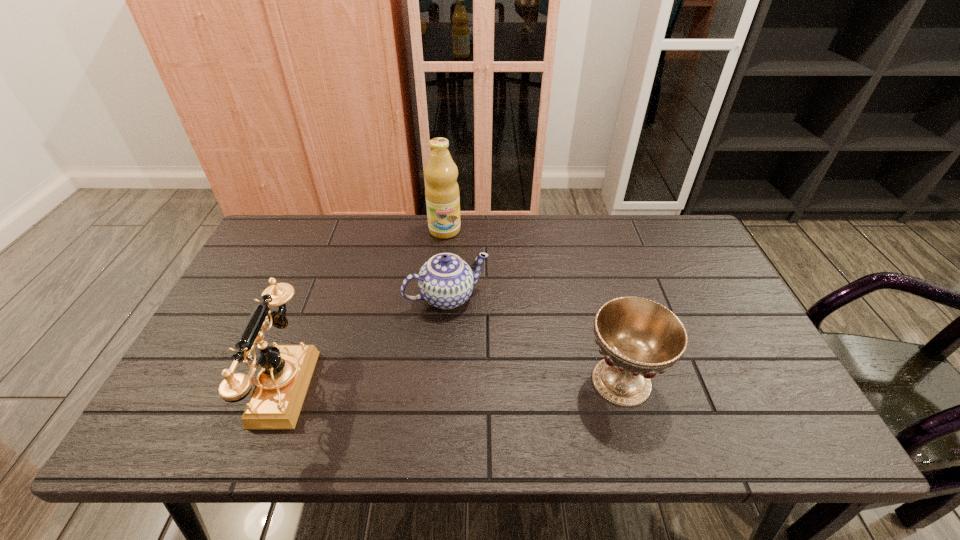
Locate an element on the screen. Image resolution: width=960 pixels, height=540 pixels. the leftmost object is located at coordinates (282, 384).

You are a GUI agent. You are given a task and a screenshot of the screen. Output one action in this format:
    pyautogui.click(x=<x>, y=<y>)
    Task: Click on the second tallest object
    
    Given the screenshot: What is the action you would take?
    pyautogui.click(x=282, y=384)

Where is `chalice`? chalice is located at coordinates (638, 337).

The image size is (960, 540). Identify the location of the rightmost object. (638, 337).

At what (x,y) coordinates should I click in order to perform the action: click on olive oil. Please return your answer as a coordinate pair (x, y). This screenshot has height=540, width=960. Looking at the image, I should click on (442, 195).

The width and height of the screenshot is (960, 540). What are the coordinates of `the farthest object` in the screenshot? It's located at (442, 195).

The height and width of the screenshot is (540, 960). Identify the location of the shortest object. click(446, 281).

Image resolution: width=960 pixels, height=540 pixels. I want to click on the third nearest object, so pyautogui.click(x=446, y=281).

The image size is (960, 540). I want to click on free region located on the dial of the second tallest object, so click(226, 386).

The height and width of the screenshot is (540, 960). What are the coordinates of `blank space located 0.060m on the dial of the second tallest object` in the screenshot? It's located at (226, 386).